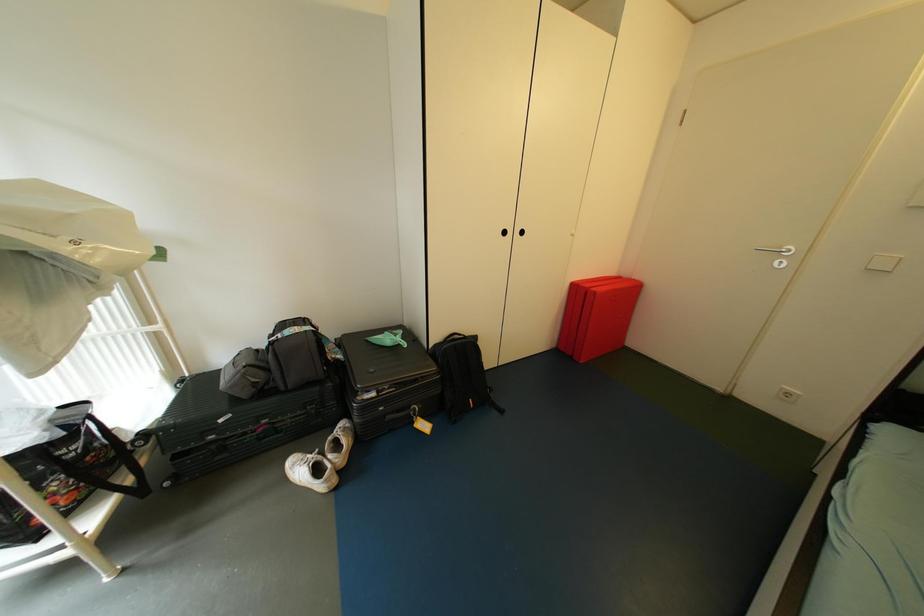
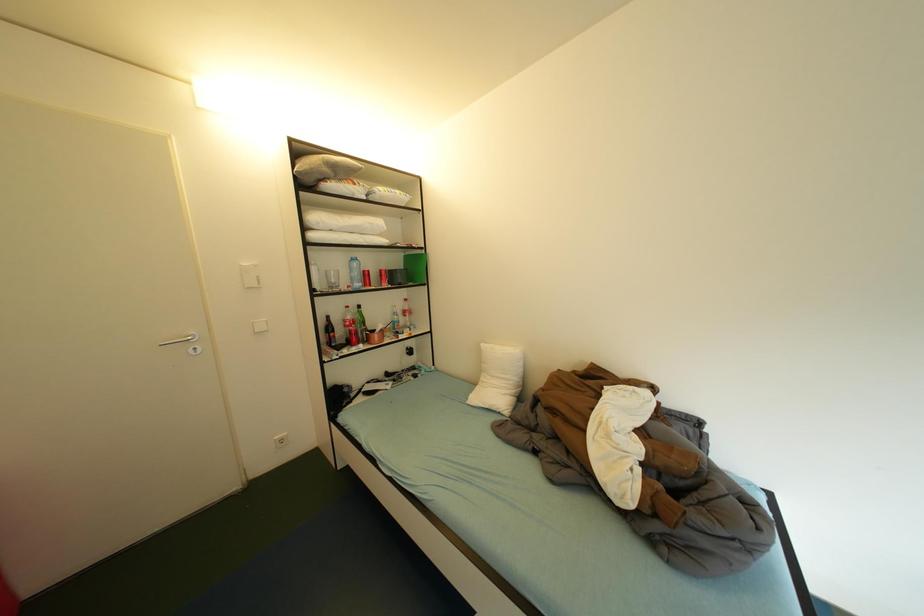
Based on the continuous images, in which direction is the camera rotating?

The camera's rotation is toward right-down.